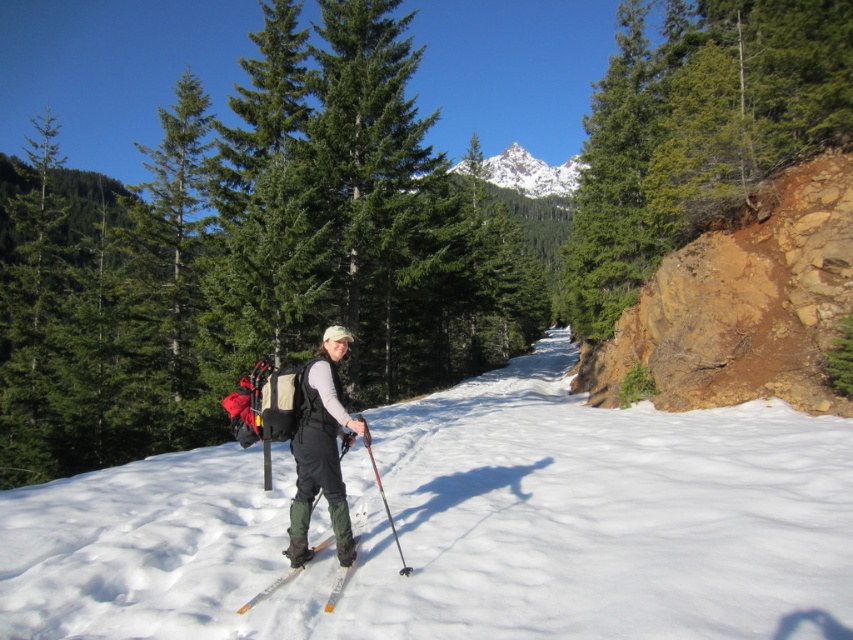
Question: Does brown rough rock at right appear on the left side of matte black ski suit at center?

Choices:
 (A) yes
 (B) no

Answer: (B)

Question: Which of these objects is positioned closest to the snowy white peak at upper center?

Choices:
 (A) white snow at center
 (B) brown rough rock at right

Answer: (B)

Question: Is the position of white snow at center less distant than that of orange metallic ski at center?

Choices:
 (A) yes
 (B) no

Answer: (A)

Question: Which of these objects is positioned farthest from the white snow at center?

Choices:
 (A) matte black ski suit at center
 (B) green matte tree at center
 (C) orange metallic ski at center

Answer: (B)

Question: Does matte black ski suit at center have a smaller size compared to orange metallic ski at center?

Choices:
 (A) no
 (B) yes

Answer: (A)

Question: Which object appears closest to the camera in this image?

Choices:
 (A) white snow at center
 (B) brown rough rock at right
 (C) matte black ski suit at center
 (D) snowy white peak at upper center

Answer: (A)